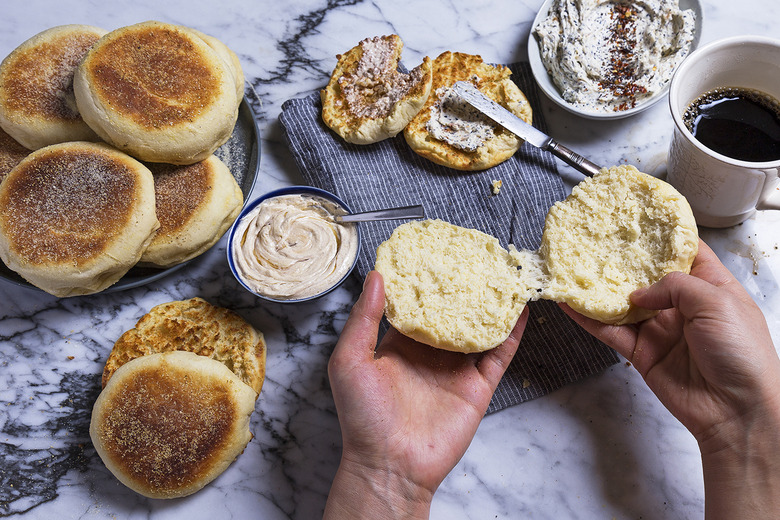
This screenshot has height=520, width=780. I want to click on coffee mug, so click(x=720, y=176).